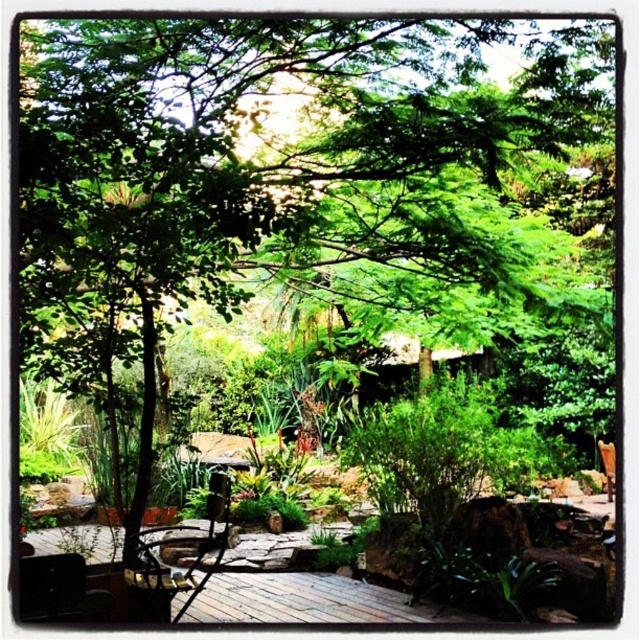
You are sitting on the wooden deck and want to choose a chair that is taller to have a better view of the garden. Which chair should you pick between the matte black chair at lower left and the brown wooden chair at lower right?

The matte black chair at lower left is taller than the brown wooden chair at lower right, so you should choose the matte black chair at lower left for a better view.

You are standing at the entrance of the garden and see the point marked at coordinates (177, 547). What object is located there?

The metallic silver chair at center is located at point (177, 547).